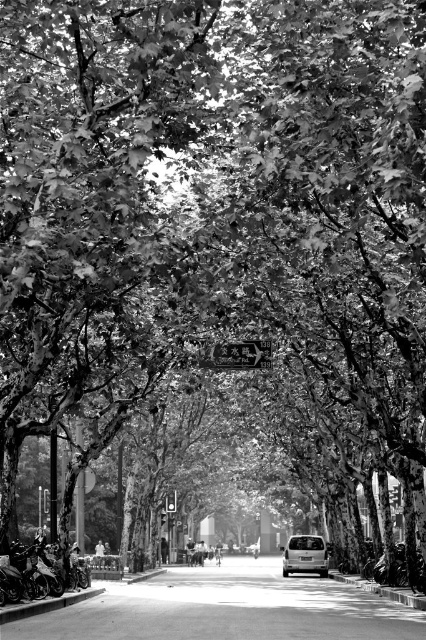
Question: Can you confirm if metallic reflective sign at center is positioned to the left of silver metallic van at center?

Choices:
 (A) no
 (B) yes

Answer: (B)

Question: Observing the image, what is the correct spatial positioning of metallic reflective sign at center in reference to silver metallic van at center?

Choices:
 (A) right
 (B) left

Answer: (B)

Question: Which object appears closest to the camera in this image?

Choices:
 (A) silver metallic van at center
 (B) metallic reflective sign at center

Answer: (B)

Question: Which point appears farthest from the camera in this image?

Choices:
 (A) (287, 570)
 (B) (241, 364)

Answer: (A)

Question: Which object appears closest to the camera in this image?

Choices:
 (A) metallic reflective sign at center
 (B) silver metallic van at center

Answer: (A)

Question: Is metallic reflective sign at center smaller than silver metallic van at center?

Choices:
 (A) no
 (B) yes

Answer: (B)